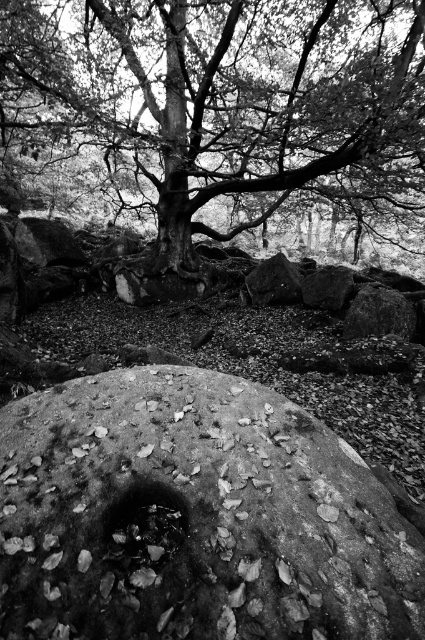
Question: Can you confirm if rough textured rock at center is wider than smooth bark tree trunk at center?

Choices:
 (A) no
 (B) yes

Answer: (B)

Question: Which point is farther to the camera?

Choices:
 (A) rough textured rock at center
 (B) smooth bark tree trunk at center

Answer: (B)

Question: Is smooth bark tree at center above smooth bark tree trunk at center?

Choices:
 (A) yes
 (B) no

Answer: (A)

Question: Does rough textured rock at center have a smaller size compared to smooth bark tree at center?

Choices:
 (A) no
 (B) yes

Answer: (B)

Question: Which object appears farthest from the camera in this image?

Choices:
 (A) smooth bark tree trunk at center
 (B) smooth bark tree at center
 (C) rough textured rock at center

Answer: (A)

Question: Based on their relative distances, which object is nearer to the smooth bark tree trunk at center?

Choices:
 (A) rough textured rock at center
 (B) smooth bark tree at center

Answer: (B)